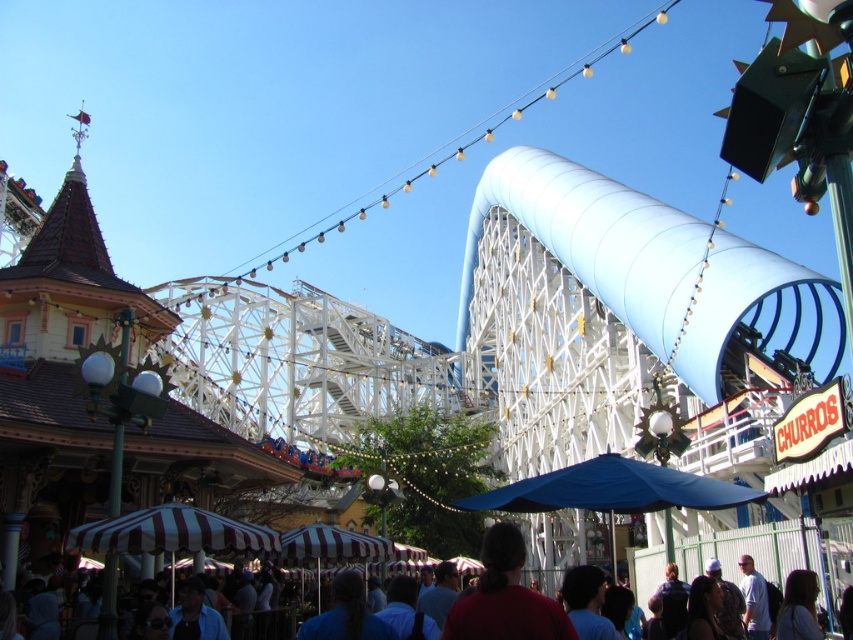
Between blue striped umbrella at lower center and red matte shirt at center, which one has less height?

With less height is red matte shirt at center.

Who is lower down, blue striped umbrella at lower center or red matte shirt at center?

blue striped umbrella at lower center is lower down.

The height and width of the screenshot is (640, 853). I want to click on blue striped umbrella at lower center, so click(776, 552).

Image resolution: width=853 pixels, height=640 pixels. I want to click on blue striped umbrella at lower center, so click(x=776, y=552).